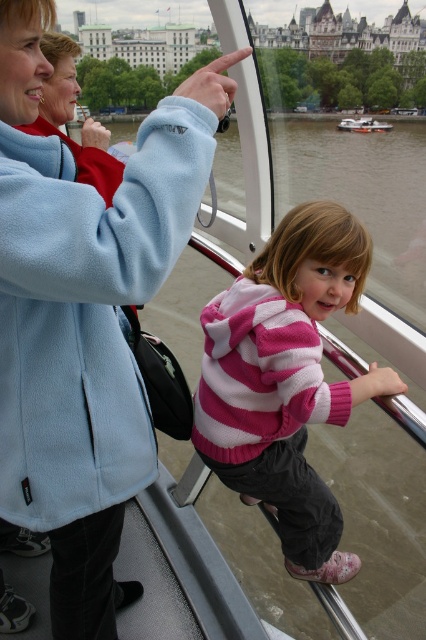
Consider the image. You are standing on the observation deck and want to take a photo of the white plastic boat at center and the brown water at center. Which object should you focus on first if you want to capture both in the same frame without moving the camera?

You should focus on the white plastic boat at center first because the brown water at center is below it, so adjusting the focus to include the boat will naturally include the water below in the frame.

You are a photographer trying to capture a photo of the white plastic boat at center and the pink striped sweater at center. Since both are at the center, how can you adjust your camera angle to ensure both are in focus?

The pink striped sweater at center is positioned under the white plastic boat at center, so tilting the camera slightly downward will bring both into focus while maintaining their central positions.

You are a photographer trying to capture a photo of the pink striped sweater at center and the brown water at center in the observation deck scene. Considering their sizes in the image, which object would you focus on first to ensure both are clearly visible in your shot?

The pink striped sweater at center occupies less space than brown water at center, so you should focus on the smaller pink striped sweater at center first to ensure it is clearly visible before adjusting for the larger brown water at center.